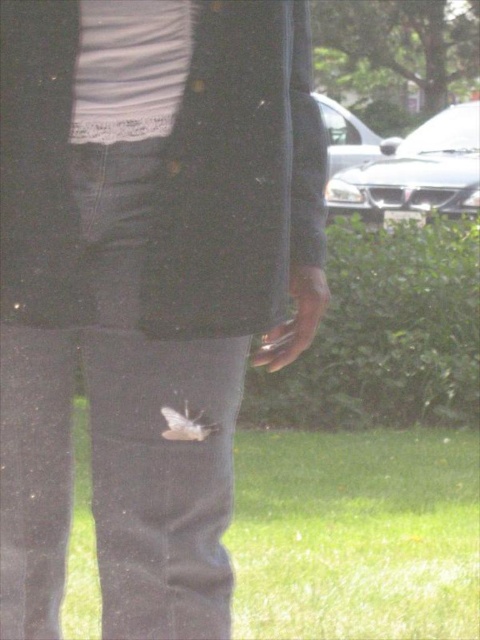
Is dark gray jeans at center further to camera compared to smooth leather hand at center?

No.

Which is behind, point (237, 301) or point (282, 362)?

Point (282, 362)

Describe the element at coordinates (142, 282) in the screenshot. Image resolution: width=480 pixels, height=640 pixels. I see `dark gray jeans at center` at that location.

The width and height of the screenshot is (480, 640). What are the coordinates of `dark gray jeans at center` in the screenshot? It's located at (142, 282).

Is point (83, 634) closer to viewer compared to point (252, 362)?

No, it is behind (252, 362).

Measure the distance between point [84,624] and camera.

A distance of 2.92 meters exists between point [84,624] and camera.

The width and height of the screenshot is (480, 640). Find the location of `green grass at lower center`. green grass at lower center is located at coordinates (356, 532).

Which is behind, point (51, 90) or point (244, 472)?

The point (244, 472) is more distant.

Between dark gray jeans at center and green grass at lower center, which one is positioned higher?

dark gray jeans at center is higher up.

The image size is (480, 640). Identify the location of dark gray jeans at center. (142, 282).